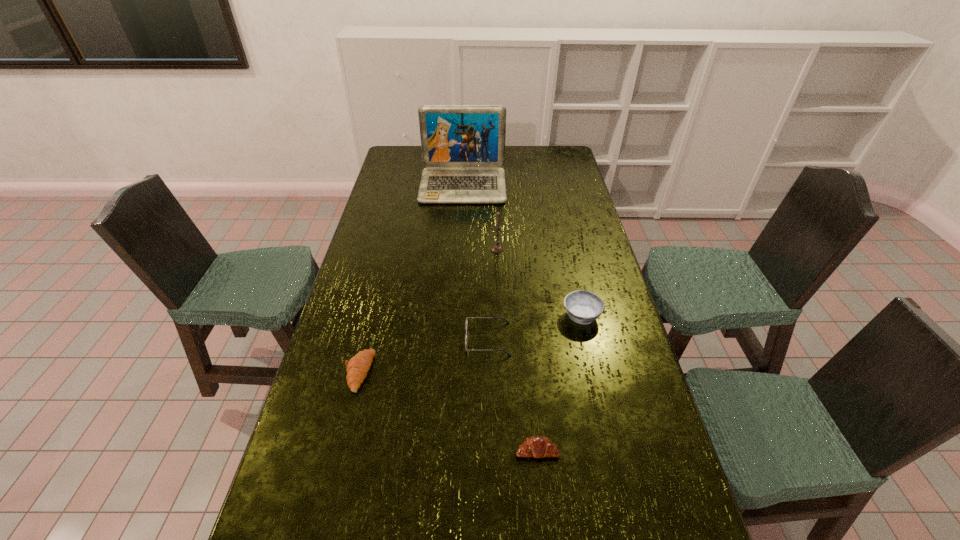
The height and width of the screenshot is (540, 960). What are the coordinates of `the farthest object` in the screenshot? It's located at (463, 146).

Find the location of `laptop computer`. laptop computer is located at coordinates (463, 146).

Where is `the second tallest object`? Image resolution: width=960 pixels, height=540 pixels. the second tallest object is located at coordinates (496, 248).

You are a GUI agent. You are given a task and a screenshot of the screen. Output one action in this format:
    pyautogui.click(x=<x>, y=<y>)
    Task: Click on the candle
    
    Given the screenshot: What is the action you would take?
    pyautogui.click(x=496, y=248)

The height and width of the screenshot is (540, 960). I want to click on the rightmost object, so click(x=584, y=307).

At what (x,y) coordinates should I click in order to perform the action: click on ashtray. Please return your answer as a coordinate pair (x, y). Looking at the image, I should click on (584, 307).

This screenshot has height=540, width=960. Identify the location of sunglasses. (507, 322).

Find the location of a particular element. This screenshot has height=540, width=960. the taller crescent roll is located at coordinates (357, 368).

Find the location of a particular element. The image size is (960, 540). the leftmost object is located at coordinates (357, 368).

The width and height of the screenshot is (960, 540). Identify the location of the right crescent roll. (536, 446).